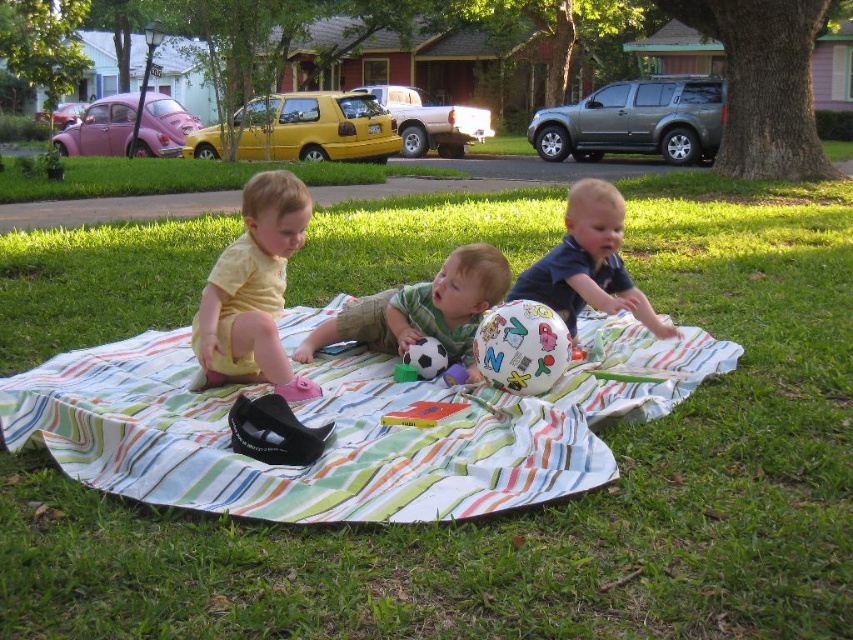
Is blue matte shirt at center smaller than multicolored rubber ball at center?

No, blue matte shirt at center is not smaller than multicolored rubber ball at center.

This screenshot has height=640, width=853. What do you see at coordinates (589, 262) in the screenshot?
I see `blue matte shirt at center` at bounding box center [589, 262].

Locate an element on the screen. blue matte shirt at center is located at coordinates (589, 262).

Can you confirm if green grass at center is positioned to the right of striped cotton blanket at center?

Correct, you'll find green grass at center to the right of striped cotton blanket at center.

Which of these two, green grass at center or striped cotton blanket at center, stands taller?

With more height is striped cotton blanket at center.

Between point (544, 211) and point (344, 497), which one is positioned in front?

Point (344, 497) is in front.

This screenshot has height=640, width=853. What are the coordinates of `green grass at center` in the screenshot? It's located at (546, 502).

Which of these two, striped cotton blanket at center or blue matte shirt at center, stands taller?

blue matte shirt at center is taller.

Is point (114, 449) farther from camera compared to point (610, 186)?

No, (114, 449) is in front of (610, 186).

The width and height of the screenshot is (853, 640). I want to click on striped cotton blanket at center, so click(346, 429).